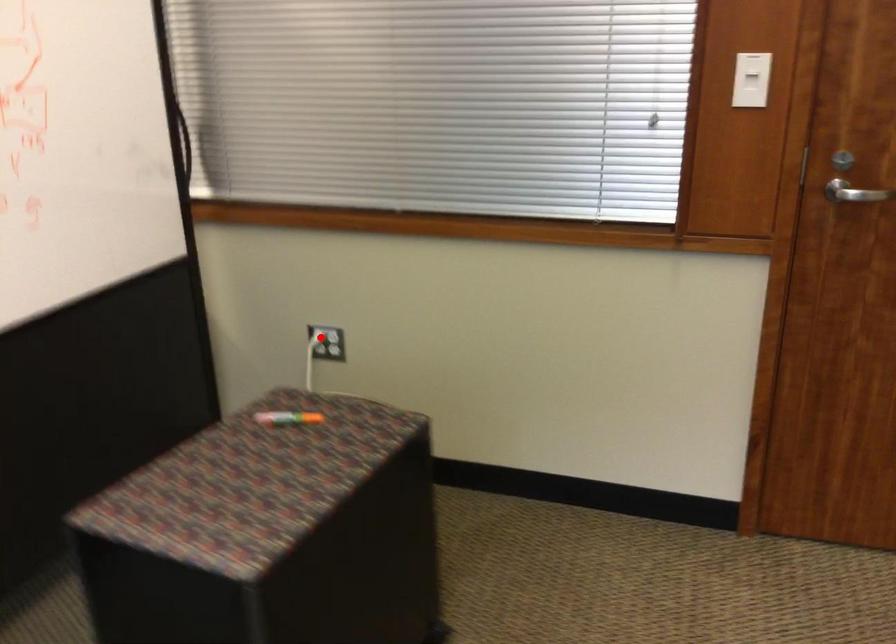
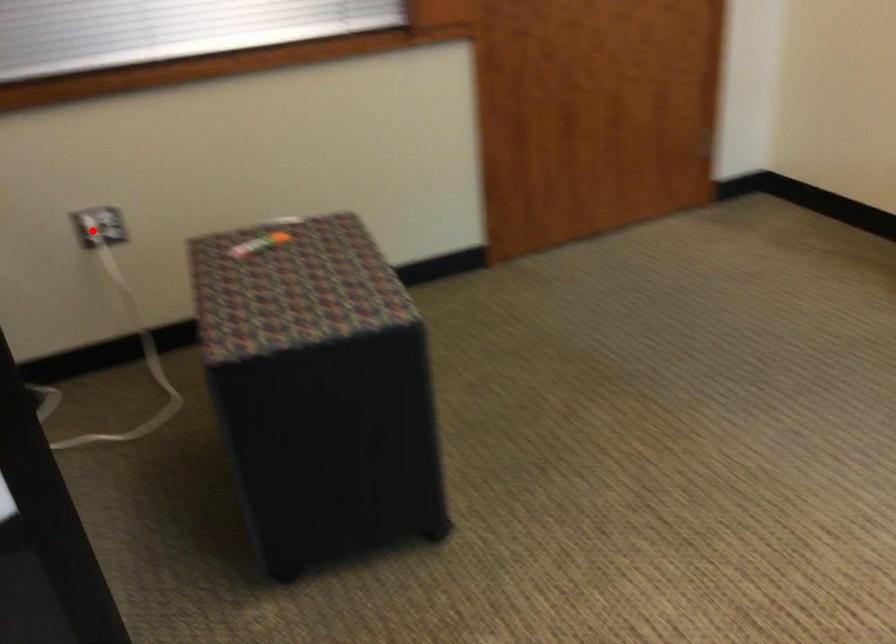
I am providing you with two images of the same scene from different viewpoints. A red point is marked on the first image and another point is marked on the second image. Is the red point in image1 aligned with the point shown in image2?

Yes